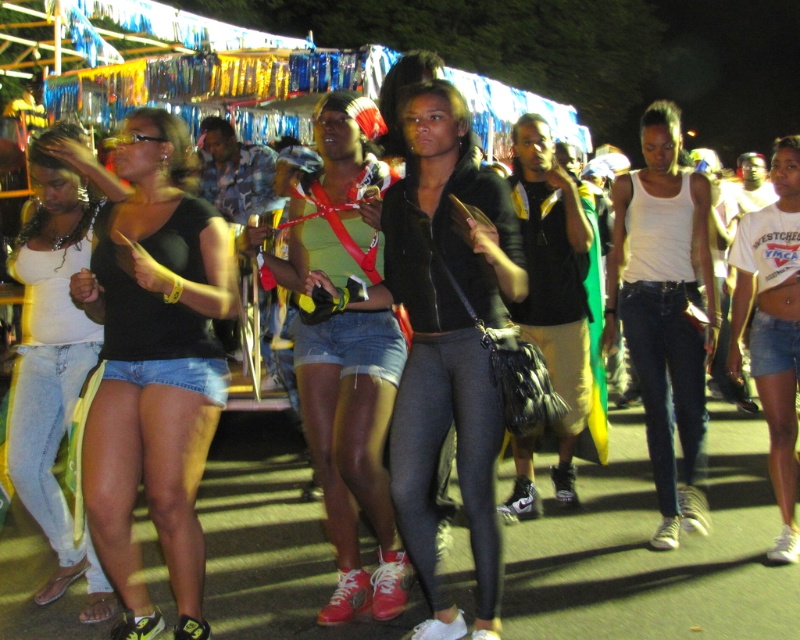
Question: Which object is positioned closest to the white matte tank top at center?

Choices:
 (A) matte black jacket at center
 (B) denim shorts at center
 (C) white cotton t-shirt at center

Answer: (C)

Question: Among these points, which one is farthest from the camera?

Choices:
 (A) (798, 250)
 (B) (356, 355)
 (C) (30, 330)

Answer: (A)

Question: Which object appears farthest from the camera in this image?

Choices:
 (A) light blue denim shorts at left
 (B) matte black jacket at center

Answer: (A)

Question: Can you confirm if matte black jacket at center is positioned to the left of white cotton t-shirt at center?

Choices:
 (A) yes
 (B) no

Answer: (A)

Question: Does matte black jacket at center appear on the right side of light blue denim shorts at left?

Choices:
 (A) yes
 (B) no

Answer: (A)

Question: Is matte black jacket at center positioned at the back of white matte tank top at center?

Choices:
 (A) yes
 (B) no

Answer: (B)